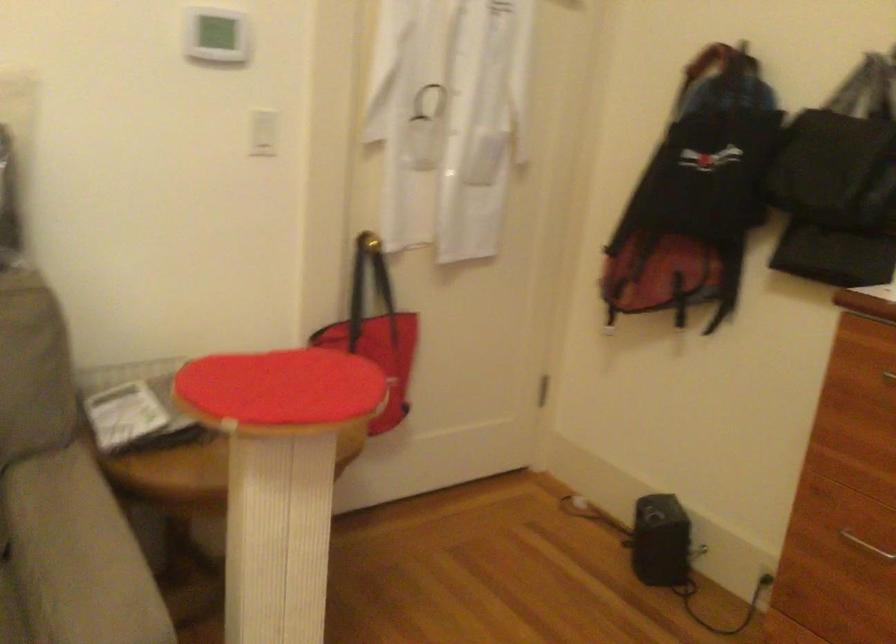
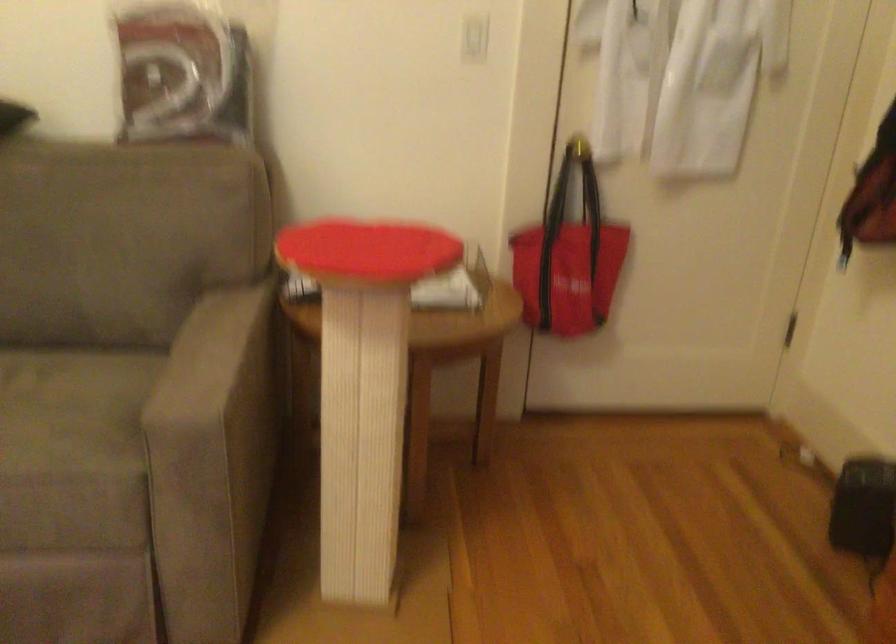
Find the pixel in the second image that matches the point at 373,247 in the first image.

(579, 147)